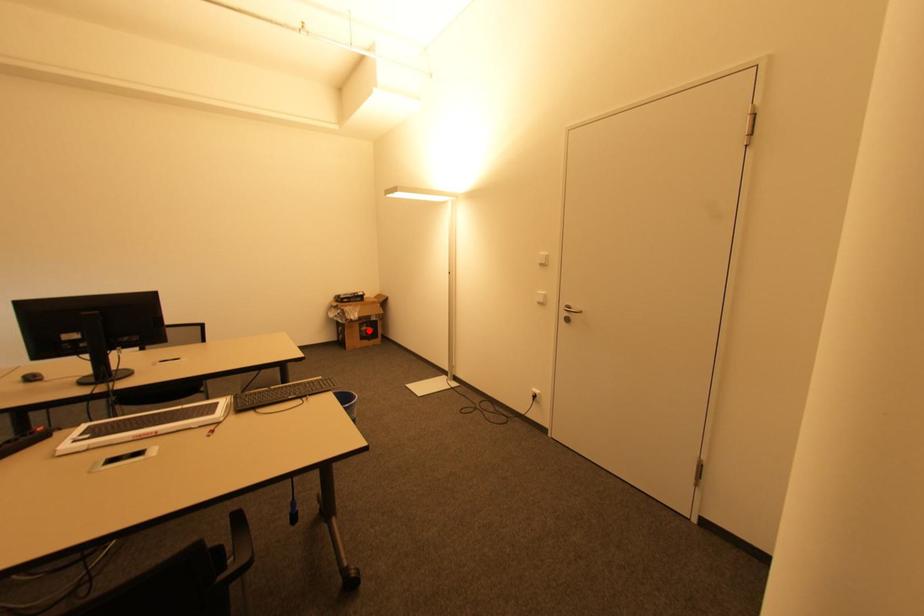
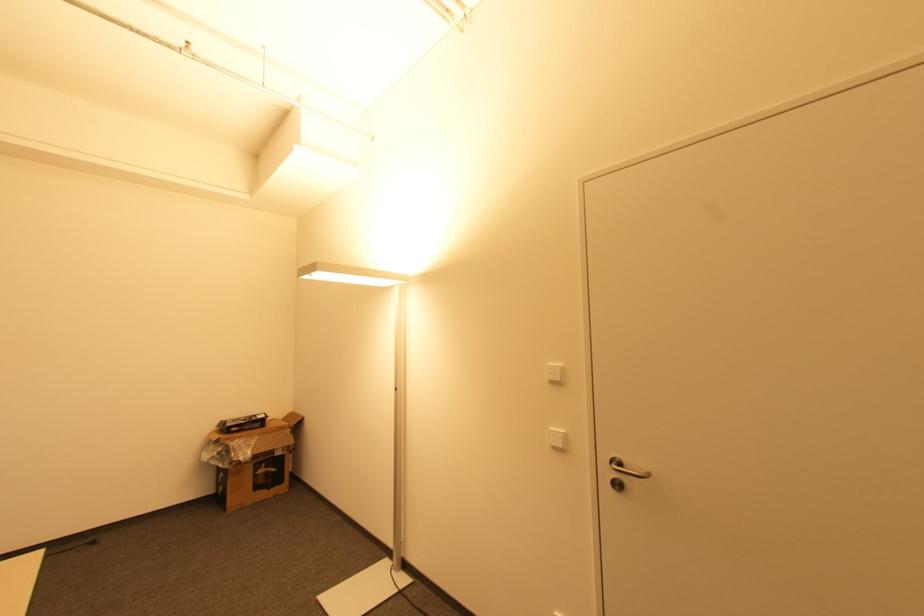
Question: I am providing you with two images of the same scene from different viewpoints. Given a red point in image1, look at the same physical point in image2. Is it:

Choices:
 (A) Closer to the viewpoint
 (B) Farther from the viewpoint

Answer: (B)